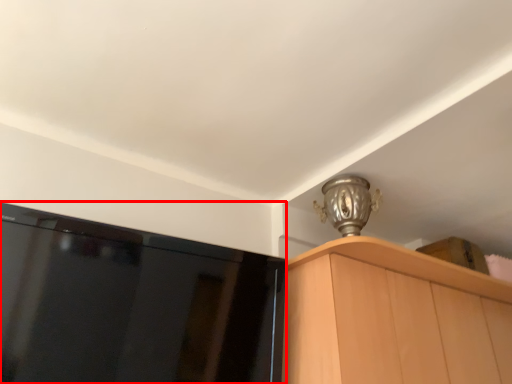
Question: In this image, where is screen (annotated by the red box) located relative to cabinetry?

Choices:
 (A) right
 (B) left

Answer: (B)